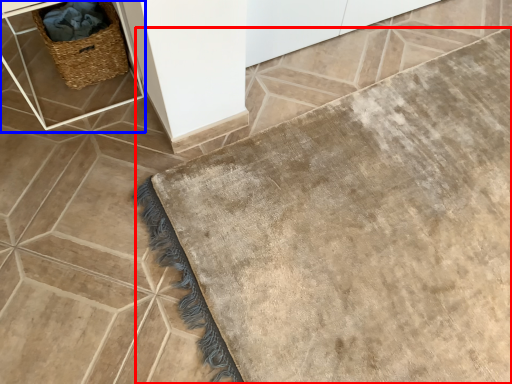
Question: Which object is closer to the camera taking this photo, bath mat (highlighted by a red box) or table (highlighted by a blue box)?

Choices:
 (A) bath mat
 (B) table

Answer: (A)